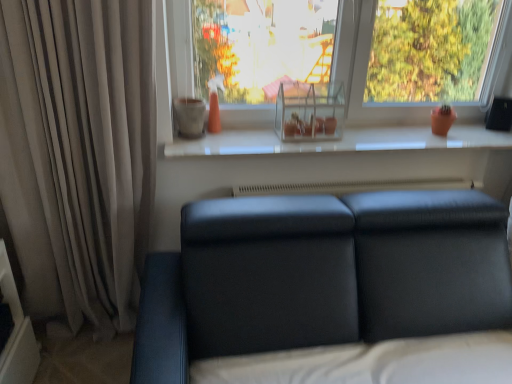
Find the location of a particular element. This screenshot has height=384, width=512. white glossy window sill at center is located at coordinates (339, 141).

Image resolution: width=512 pixels, height=384 pixels. Describe the element at coordinates (79, 154) in the screenshot. I see `beige fabric curtain at left` at that location.

I want to click on matte black couch at lower center, so click(x=331, y=292).

The width and height of the screenshot is (512, 384). I want to click on white glossy window sill at center, so click(339, 141).

How far apart are transparent glass shelf at upper center and white glossy window sill at center?

transparent glass shelf at upper center and white glossy window sill at center are 12.40 inches apart from each other.

Which of these two, transparent glass shelf at upper center or white glossy window sill at center, is smaller?

white glossy window sill at center.

Which is behind, point (356, 18) or point (313, 147)?

Positioned behind is point (313, 147).

Is transparent glass shelf at upper center looking in the opposite direction of white glossy window sill at center?

Answer: transparent glass shelf at upper center does not have its back to white glossy window sill at center.

Can you confirm if white glossy window sill at center is thinner than transparent glass shelf at upper center?

No, white glossy window sill at center is not thinner than transparent glass shelf at upper center.

Image resolution: width=512 pixels, height=384 pixels. There is a white glossy window sill at center. In order to click on window above it (from a real-world perspective) in this screenshot , I will do `click(366, 70)`.

Between white glossy window sill at center and transparent glass shelf at upper center, which one is positioned behind?

white glossy window sill at center is further from the camera.

Would you say white glossy window sill at center is a long distance from matte black couch at lower center?

No, there isn't a large distance between white glossy window sill at center and matte black couch at lower center.

Is the position of white glossy window sill at center more distant than that of matte black couch at lower center?

That is True.

Is matte black couch at lower center at the back of white glossy window sill at center?

That's not correct — white glossy window sill at center is not looking away from matte black couch at lower center.

Would you say white glossy window sill at center is to the left or to the right of beige fabric curtain at left in the picture?

Based on their positions, white glossy window sill at center is located to the right of beige fabric curtain at left.

Based on the photo, which of these two, white glossy window sill at center or beige fabric curtain at left, stands shorter?

white glossy window sill at center.

Is white glossy window sill at center positioned before beige fabric curtain at left?

No, the depth of white glossy window sill at center is greater than that of beige fabric curtain at left.

Between beige fabric curtain at left and transparent glass shelf at upper center, which one is positioned behind?

transparent glass shelf at upper center is further from the camera.

Between beige fabric curtain at left and transparent glass shelf at upper center, which one has smaller size?

transparent glass shelf at upper center.

Is beige fabric curtain at left to the left or to the right of transparent glass shelf at upper center in the image?

In the image, beige fabric curtain at left appears on the left side of transparent glass shelf at upper center.

From a real-world perspective, relative to transparent glass shelf at upper center, is beige fabric curtain at left vertically above or below?

beige fabric curtain at left is situated lower than transparent glass shelf at upper center in the real world.

Would you consider transparent glass shelf at upper center to be distant from matte black couch at lower center?

transparent glass shelf at upper center is positioned a significant distance from matte black couch at lower center.

Considering the points (163, 122) and (464, 222), which point is in front, point (163, 122) or point (464, 222)?

Point (464, 222)

Could you tell me if transparent glass shelf at upper center is facing matte black couch at lower center?

No.

Considering the relative sizes of matte black couch at lower center and transparent glass shelf at upper center in the image provided, is matte black couch at lower center shorter than transparent glass shelf at upper center?

No.

Considering the relative positions of matte black couch at lower center and transparent glass shelf at upper center in the image provided, is matte black couch at lower center to the left or to the right of transparent glass shelf at upper center?

matte black couch at lower center is to the left of transparent glass shelf at upper center.

Based on the photo, is matte black couch at lower center positioned with its back to transparent glass shelf at upper center?

No, matte black couch at lower center's orientation is not away from transparent glass shelf at upper center.

Is matte black couch at lower center positioned far away from transparent glass shelf at upper center?

That's right, there is a large distance between matte black couch at lower center and transparent glass shelf at upper center.

There is a white glossy window sill at center. Identify the location of window above it (from a real-world perspective). (366, 70).

Image resolution: width=512 pixels, height=384 pixels. Identify the location of window sill behind the transparent glass shelf at upper center. (339, 141).

Estimate the real-world distances between objects in this image. Which object is further from beige fabric curtain at left, matte black couch at lower center or white glossy window sill at center?

Based on the image, matte black couch at lower center appears to be further to beige fabric curtain at left.

Considering their positions, is transparent glass shelf at upper center positioned closer to matte black couch at lower center than beige fabric curtain at left?

beige fabric curtain at left.

In the scene shown: From the image, which object appears to be farther from white glossy window sill at center, transparent glass shelf at upper center or matte black couch at lower center?

Among the two, matte black couch at lower center is located further to white glossy window sill at center.

Based on the photo, which object lies nearer to the anchor point white glossy window sill at center, matte black couch at lower center or transparent glass shelf at upper center?

Among the two, transparent glass shelf at upper center is located nearer to white glossy window sill at center.

Which object lies nearer to the anchor point white glossy window sill at center, beige fabric curtain at left or matte black couch at lower center?

beige fabric curtain at left lies closer to white glossy window sill at center than the other object.

Based on their spatial positions, is matte black couch at lower center or beige fabric curtain at left closer to transparent glass shelf at upper center?

The object closer to transparent glass shelf at upper center is matte black couch at lower center.

Which object lies nearer to the anchor point beige fabric curtain at left, transparent glass shelf at upper center or white glossy window sill at center?

white glossy window sill at center is closer to beige fabric curtain at left.

Considering their positions, is matte black couch at lower center positioned further to white glossy window sill at center than beige fabric curtain at left?

Among the two, matte black couch at lower center is located further to white glossy window sill at center.

Find the location of `studio couch situated between beige fabric curtain at left and white glossy window sill at center from left to right`. studio couch situated between beige fabric curtain at left and white glossy window sill at center from left to right is located at coordinates (331, 292).

The width and height of the screenshot is (512, 384). I want to click on window sill between transparent glass shelf at upper center and matte black couch at lower center from top to bottom, so click(x=339, y=141).

Find the location of `studio couch between beige fabric curtain at left and transparent glass shelf at upper center`. studio couch between beige fabric curtain at left and transparent glass shelf at upper center is located at coordinates (331, 292).

The width and height of the screenshot is (512, 384). I want to click on window located between beige fabric curtain at left and white glossy window sill at center in the left-right direction, so click(366, 70).